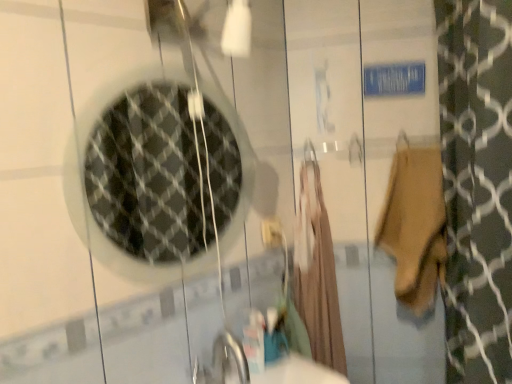
Describe the element at coordinates (317, 275) in the screenshot. The height and width of the screenshot is (384, 512). I see `beige fabric robe at center` at that location.

Describe the element at coordinates (415, 225) in the screenshot. I see `beige cotton towel at right` at that location.

You are a GUI agent. You are given a task and a screenshot of the screen. Output one action in this format:
    pyautogui.click(x=<x>, y=<y>)
    Task: Click on the white plastic electric outlet at center
    The image size is (512, 384).
    Given the screenshot: What is the action you would take?
    pyautogui.click(x=271, y=232)

What are the coordinates of `clear glass mirror at upper left` in the screenshot? It's located at (147, 175).

Where is `bath towel that appears in front of the beige fabric robe at center`? This screenshot has width=512, height=384. bath towel that appears in front of the beige fabric robe at center is located at coordinates (415, 225).

Who is more distant, beige fabric robe at center or beige cotton towel at right?

Positioned behind is beige fabric robe at center.

From a real-world perspective, is beige fabric robe at center physically above beige cotton towel at right?

No, from a real-world perspective, beige fabric robe at center is not on top of beige cotton towel at right.

Does point (275, 238) appear closer or farther from the camera than point (192, 139)?

Point (275, 238) appears to be closer to the viewer than point (192, 139).

From a real-world perspective, is white plastic electric outlet at center above or below clear glass mirror at upper left?

From a real-world perspective, white plastic electric outlet at center is physically below clear glass mirror at upper left.

Based on their sizes in the image, would you say white plastic electric outlet at center is bigger or smaller than clear glass mirror at upper left?

Considering their sizes, white plastic electric outlet at center takes up less space than clear glass mirror at upper left.

Does white plastic electric outlet at center lie in front of clear glass mirror at upper left?

No, white plastic electric outlet at center is further to the viewer.

Does beige cotton towel at right have a lesser height compared to clear glass mirror at upper left?

Result: Indeed, beige cotton towel at right has a lesser height compared to clear glass mirror at upper left.

Is beige cotton towel at right not near clear glass mirror at upper left?

No.

What's the angular difference between beige cotton towel at right and clear glass mirror at upper left's facing directions?

beige cotton towel at right and clear glass mirror at upper left are facing 53 degrees away from each other.

What's the angular difference between beige cotton towel at right and white plastic electric outlet at center's facing directions?

beige cotton towel at right and white plastic electric outlet at center are facing 48.8 degrees away from each other.

Considering the positions of points (439, 191) and (275, 220), is point (439, 191) closer to camera compared to point (275, 220)?

Yes, it is.

Is beige cotton towel at right located outside white plastic electric outlet at center?

Indeed, beige cotton towel at right is completely outside white plastic electric outlet at center.

Looking at this image, which object is closer to the camera, beige cotton towel at right or white plastic electric outlet at center?

beige cotton towel at right.

Based on the photo, from a real-world perspective, is white plastic electric outlet at center positioned above or below beige fabric robe at center?

Clearly, from a real-world perspective, white plastic electric outlet at center is above beige fabric robe at center.

Which is more to the right, white plastic electric outlet at center or beige fabric robe at center?

Positioned to the right is beige fabric robe at center.

Does white plastic electric outlet at center turn towards beige fabric robe at center?

No, white plastic electric outlet at center is not aimed at beige fabric robe at center.

Is clear glass mirror at upper left to the left or to the right of beige cotton towel at right in the image?

clear glass mirror at upper left is to the left of beige cotton towel at right.

Which is closer, (x=221, y=164) or (x=405, y=204)?

Clearly, point (x=221, y=164) is more distant from the camera than point (x=405, y=204).

From the image's perspective, is clear glass mirror at upper left on top of beige cotton towel at right?

Correct, clear glass mirror at upper left appears higher than beige cotton towel at right in the image.

How different are the orientations of clear glass mirror at upper left and beige cotton towel at right in degrees?

There is a 53-degree angle between the facing directions of clear glass mirror at upper left and beige cotton towel at right.

Which of these two, beige fabric robe at center or white plastic electric outlet at center, is wider?

beige fabric robe at center is wider.

Considering the sizes of beige fabric robe at center and white plastic electric outlet at center in the image, is beige fabric robe at center taller or shorter than white plastic electric outlet at center?

In the image, beige fabric robe at center appears to be taller than white plastic electric outlet at center.

Is beige fabric robe at center in front of white plastic electric outlet at center?

Yes, the depth of beige fabric robe at center is less than that of white plastic electric outlet at center.

Is beige fabric robe at center situated inside white plastic electric outlet at center or outside?

beige fabric robe at center is not enclosed by white plastic electric outlet at center.

I want to click on bath towel on the right of beige fabric robe at center, so click(415, 225).

This screenshot has width=512, height=384. What are the coordinates of `mirror located above the white plastic electric outlet at center (from a real-world perspective)` in the screenshot? It's located at (147, 175).

Considering their positions, is beige cotton towel at right positioned closer to clear glass mirror at upper left than white plastic electric outlet at center?

white plastic electric outlet at center.

Considering their positions, is clear glass mirror at upper left positioned further to beige cotton towel at right than white plastic electric outlet at center?

clear glass mirror at upper left lies further to beige cotton towel at right than the other object.

Looking at the image, which one is located closer to white plastic electric outlet at center, beige fabric robe at center or clear glass mirror at upper left?

beige fabric robe at center is closer to white plastic electric outlet at center.

Based on their spatial positions, is beige cotton towel at right or clear glass mirror at upper left closer to beige fabric robe at center?

beige cotton towel at right lies closer to beige fabric robe at center than the other object.

Considering their positions, is beige fabric robe at center positioned closer to beige cotton towel at right than clear glass mirror at upper left?

Based on the image, beige fabric robe at center appears to be nearer to beige cotton towel at right.

Estimate the real-world distances between objects in this image. Which object is further from beige fabric robe at center, white plastic electric outlet at center or beige cotton towel at right?

beige cotton towel at right.

From the image, which object appears to be nearer to beige fabric robe at center, clear glass mirror at upper left or white plastic electric outlet at center?

The object closer to beige fabric robe at center is white plastic electric outlet at center.

Which object lies nearer to the anchor point white plastic electric outlet at center, beige cotton towel at right or clear glass mirror at upper left?

beige cotton towel at right.

This screenshot has height=384, width=512. In order to click on electric outlet between clear glass mirror at upper left and beige cotton towel at right from left to right in this screenshot , I will do `click(271, 232)`.

This screenshot has width=512, height=384. I want to click on robe between clear glass mirror at upper left and white plastic electric outlet at center from front to back, so click(x=317, y=275).

Image resolution: width=512 pixels, height=384 pixels. Find the location of `robe between white plastic electric outlet at center and beige cotton towel at right in the horizontal direction`. robe between white plastic electric outlet at center and beige cotton towel at right in the horizontal direction is located at coordinates (317, 275).

Image resolution: width=512 pixels, height=384 pixels. Identify the location of robe situated between clear glass mirror at upper left and beige cotton towel at right from left to right. (317, 275).